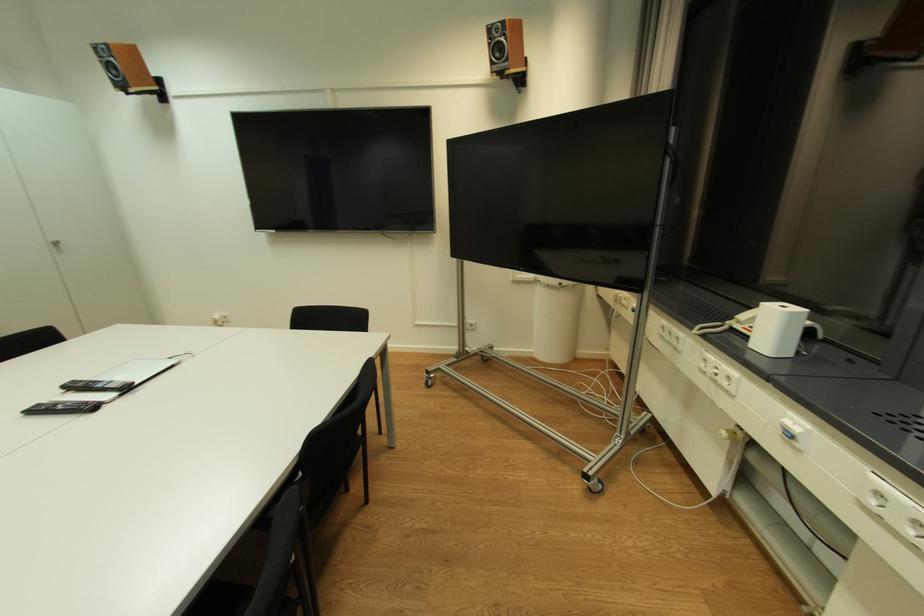
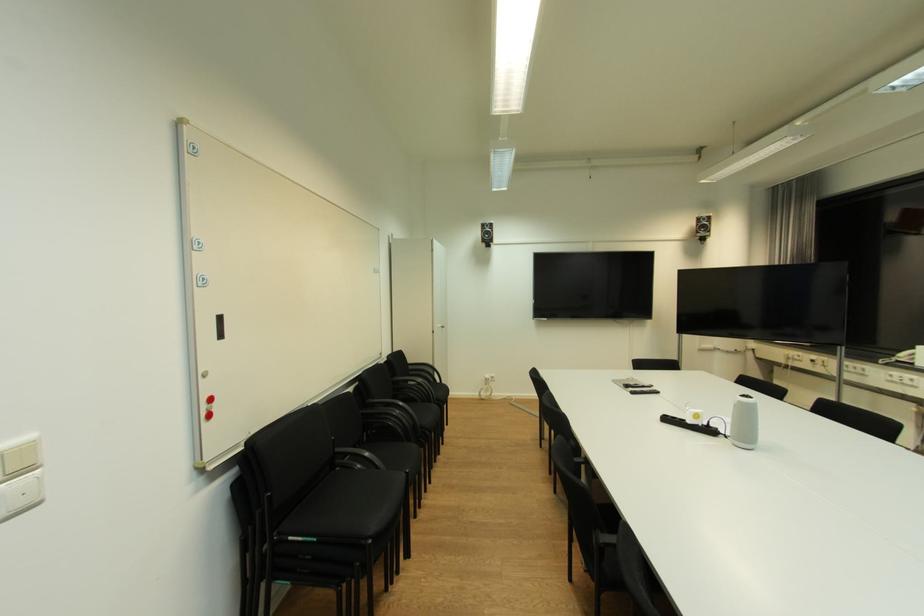
Locate, in the second image, the point that corresponds to (505,55) in the first image.

(708, 231)